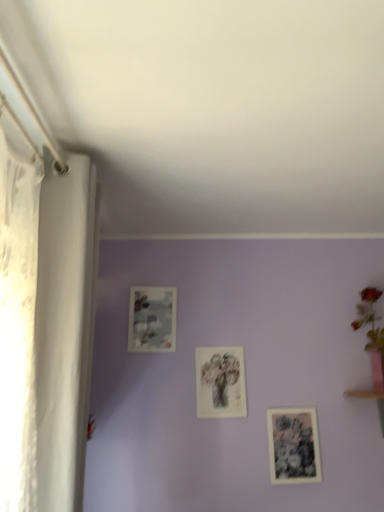
Where is `matte floral print at center, the 2th picture frame from the top`? The width and height of the screenshot is (384, 512). matte floral print at center, the 2th picture frame from the top is located at coordinates (220, 382).

Image resolution: width=384 pixels, height=512 pixels. Identify the location of white sheer curtain at left. (65, 328).

Measure the distance between point (291, 459) and camera.

The depth of point (291, 459) is 6.70 feet.

The width and height of the screenshot is (384, 512). Describe the element at coordinates (293, 446) in the screenshot. I see `black paper picture frame at lower right, the third picture frame from the top` at that location.

At what (x,y) coordinates should I click in order to perform the action: click on matte floral print at upper center, marked as the third picture frame in a bottom-to-top arrangement. Please return your answer as a coordinate pair (x, y). The height and width of the screenshot is (512, 384). Looking at the image, I should click on (152, 319).

In the scene shown: From a real-world perspective, is black paper picture frame at lower right, acting as the first picture frame starting from the bottom, beneath matte floral print at center, arranged as the 2th picture frame when viewed from the left?

Yes.

Consider the image. How many degrees apart are the facing directions of black paper picture frame at lower right, arranged as the 3th picture frame when viewed from the left, and matte floral print at center, arranged as the 2th picture frame when viewed from the left?

0.0133 degrees.

Would you say matte floral print at center, arranged as the 2th picture frame when viewed from the left, is part of black paper picture frame at lower right, the third picture frame from the top,'s contents?

No, black paper picture frame at lower right, the third picture frame from the top, does not contain matte floral print at center, arranged as the 2th picture frame when viewed from the left.

From the image's perspective, is black paper picture frame at lower right, arranged as the 3th picture frame when viewed from the left, on top of white sheer curtain at left?

Actually, black paper picture frame at lower right, arranged as the 3th picture frame when viewed from the left, appears below white sheer curtain at left in the image.

Considering the relative sizes of black paper picture frame at lower right, arranged as the first picture frame when viewed from the right, and white sheer curtain at left in the image provided, is black paper picture frame at lower right, arranged as the first picture frame when viewed from the right, bigger than white sheer curtain at left?

Incorrect, black paper picture frame at lower right, arranged as the first picture frame when viewed from the right, is not larger than white sheer curtain at left.

What's the angular difference between black paper picture frame at lower right, arranged as the 3th picture frame when viewed from the left, and white sheer curtain at left's facing directions?

The facing directions of black paper picture frame at lower right, arranged as the 3th picture frame when viewed from the left, and white sheer curtain at left are 90 degrees apart.

Considering the sizes of black paper picture frame at lower right, the third picture frame from the top, and white sheer curtain at left in the image, is black paper picture frame at lower right, the third picture frame from the top, wider or thinner than white sheer curtain at left?

In the image, black paper picture frame at lower right, the third picture frame from the top, appears to be more narrow than white sheer curtain at left.

Can you confirm if matte floral print at center, which is the 2th picture frame in right-to-left order, is smaller than white sheer curtain at left?

Yes, matte floral print at center, which is the 2th picture frame in right-to-left order, is smaller than white sheer curtain at left.

Is matte floral print at center, which is the 2th picture frame in right-to-left order, oriented away from white sheer curtain at left?

matte floral print at center, which is the 2th picture frame in right-to-left order, does not have its back to white sheer curtain at left.

Is matte floral print at center, which appears as the second picture frame when ordered from the bottom, completely or partially outside of white sheer curtain at left?

Yes, matte floral print at center, which appears as the second picture frame when ordered from the bottom, is outside of white sheer curtain at left.

Can we say pink ceramic vase at upper right lies outside matte floral print at center, which appears as the second picture frame when ordered from the bottom?

Yes, pink ceramic vase at upper right is not within matte floral print at center, which appears as the second picture frame when ordered from the bottom.

From the image's perspective, is pink ceramic vase at upper right on matte floral print at center, which is the 2th picture frame in right-to-left order?

Yes, from the image's perspective, pink ceramic vase at upper right is above matte floral print at center, which is the 2th picture frame in right-to-left order.

From a real-world perspective, which is physically above, pink ceramic vase at upper right or matte floral print at center, which appears as the second picture frame when ordered from the bottom?

From a 3D spatial view, pink ceramic vase at upper right is above.

Can you confirm if pink ceramic vase at upper right is wider than matte floral print at center, which appears as the second picture frame when ordered from the bottom?

Indeed, pink ceramic vase at upper right has a greater width compared to matte floral print at center, which appears as the second picture frame when ordered from the bottom.

Can you confirm if black paper picture frame at lower right, arranged as the first picture frame when viewed from the right, is thinner than matte floral print at upper center, marked as the third picture frame in a bottom-to-top arrangement?

Correct, the width of black paper picture frame at lower right, arranged as the first picture frame when viewed from the right, is less than that of matte floral print at upper center, marked as the third picture frame in a bottom-to-top arrangement.

Does black paper picture frame at lower right, the third picture frame from the top, contain matte floral print at upper center, placed as the 1th picture frame when sorted from left to right?

No.

How different are the orientations of black paper picture frame at lower right, acting as the first picture frame starting from the bottom, and matte floral print at upper center, the 3th picture frame in the right-to-left sequence, in degrees?

0.00651 degrees.

From a real-world perspective, who is located higher, black paper picture frame at lower right, arranged as the first picture frame when viewed from the right, or matte floral print at upper center, marked as the third picture frame in a bottom-to-top arrangement?

In real-world perspective, matte floral print at upper center, marked as the third picture frame in a bottom-to-top arrangement, is above.

Is matte floral print at center, arranged as the 2th picture frame when viewed from the left, next to black paper picture frame at lower right, acting as the first picture frame starting from the bottom, and touching it?

No, matte floral print at center, arranged as the 2th picture frame when viewed from the left, is not next to black paper picture frame at lower right, acting as the first picture frame starting from the bottom.

Is matte floral print at center, which appears as the second picture frame when ordered from the bottom, thinner than black paper picture frame at lower right, arranged as the first picture frame when viewed from the right?

Correct, the width of matte floral print at center, which appears as the second picture frame when ordered from the bottom, is less than that of black paper picture frame at lower right, arranged as the first picture frame when viewed from the right.

Is point (221, 362) positioned before point (290, 445)?

No, (221, 362) is further to viewer.

How different are the orientations of matte floral print at upper center, the 3th picture frame in the right-to-left sequence, and pink ceramic vase at upper right in degrees?

0.0048 degrees separate the facing orientations of matte floral print at upper center, the 3th picture frame in the right-to-left sequence, and pink ceramic vase at upper right.

In the image, is matte floral print at upper center, placed as the 1th picture frame when sorted from left to right, on the left side or the right side of pink ceramic vase at upper right?

Clearly, matte floral print at upper center, placed as the 1th picture frame when sorted from left to right, is on the left of pink ceramic vase at upper right in the image.

From the image's perspective, which is above, matte floral print at upper center, positioned as the 1th picture frame in top-to-bottom order, or pink ceramic vase at upper right?

matte floral print at upper center, positioned as the 1th picture frame in top-to-bottom order, from the image's perspective.

Is matte floral print at upper center, positioned as the 1th picture frame in top-to-bottom order, not within pink ceramic vase at upper right?

Yes, matte floral print at upper center, positioned as the 1th picture frame in top-to-bottom order, is not within pink ceramic vase at upper right.

From the black paper picture frame at lower right, acting as the first picture frame starting from the bottom, count 1st picture frames backward and point to it. Please provide its 2D coordinates.

[(220, 382)]

Find the location of `curtain located above the black paper picture frame at lower right, arranged as the 3th picture frame when viewed from the left (from the image's perspective)`. curtain located above the black paper picture frame at lower right, arranged as the 3th picture frame when viewed from the left (from the image's perspective) is located at coordinates (65, 328).

Based on their spatial positions, is matte floral print at center, the 2th picture frame from the top, or black paper picture frame at lower right, the third picture frame from the top, further from pink ceramic vase at upper right?

matte floral print at center, the 2th picture frame from the top, is positioned further to the anchor pink ceramic vase at upper right.

In the scene shown: From the image, which object appears to be nearer to matte floral print at center, the 2th picture frame from the top, white sheer curtain at left or matte floral print at upper center, the 3th picture frame in the right-to-left sequence?

matte floral print at upper center, the 3th picture frame in the right-to-left sequence, lies closer to matte floral print at center, the 2th picture frame from the top, than the other object.

When comparing their distances from matte floral print at upper center, the 3th picture frame in the right-to-left sequence, does pink ceramic vase at upper right or white sheer curtain at left seem closer?

The object closer to matte floral print at upper center, the 3th picture frame in the right-to-left sequence, is white sheer curtain at left.

Considering their positions, is matte floral print at center, which is the 2th picture frame in right-to-left order, positioned closer to white sheer curtain at left than black paper picture frame at lower right, arranged as the first picture frame when viewed from the right?

matte floral print at center, which is the 2th picture frame in right-to-left order.

From the image, which object appears to be farther from black paper picture frame at lower right, the third picture frame from the top, pink ceramic vase at upper right or white sheer curtain at left?

The object further to black paper picture frame at lower right, the third picture frame from the top, is white sheer curtain at left.

Considering their positions, is pink ceramic vase at upper right positioned closer to matte floral print at center, which is the 2th picture frame in right-to-left order, than matte floral print at upper center, placed as the 1th picture frame when sorted from left to right?

Among the two, matte floral print at upper center, placed as the 1th picture frame when sorted from left to right, is located nearer to matte floral print at center, which is the 2th picture frame in right-to-left order.

Estimate the real-world distances between objects in this image. Which object is closer to matte floral print at upper center, positioned as the 1th picture frame in top-to-bottom order, pink ceramic vase at upper right or black paper picture frame at lower right, arranged as the first picture frame when viewed from the right?

The object closer to matte floral print at upper center, positioned as the 1th picture frame in top-to-bottom order, is black paper picture frame at lower right, arranged as the first picture frame when viewed from the right.

Looking at the image, which one is located closer to pink ceramic vase at upper right, matte floral print at center, which is the 2th picture frame in right-to-left order, or white sheer curtain at left?

matte floral print at center, which is the 2th picture frame in right-to-left order.

This screenshot has height=512, width=384. I want to click on picture frame situated between matte floral print at upper center, the 3th picture frame in the right-to-left sequence, and black paper picture frame at lower right, the third picture frame from the top, from left to right, so click(220, 382).

Where is `picture frame between white sheer curtain at left and matte floral print at center, which is the 2th picture frame in right-to-left order, from front to back`? This screenshot has height=512, width=384. picture frame between white sheer curtain at left and matte floral print at center, which is the 2th picture frame in right-to-left order, from front to back is located at coordinates (293, 446).

This screenshot has width=384, height=512. I want to click on picture frame between matte floral print at center, arranged as the 2th picture frame when viewed from the left, and pink ceramic vase at upper right, so click(x=293, y=446).